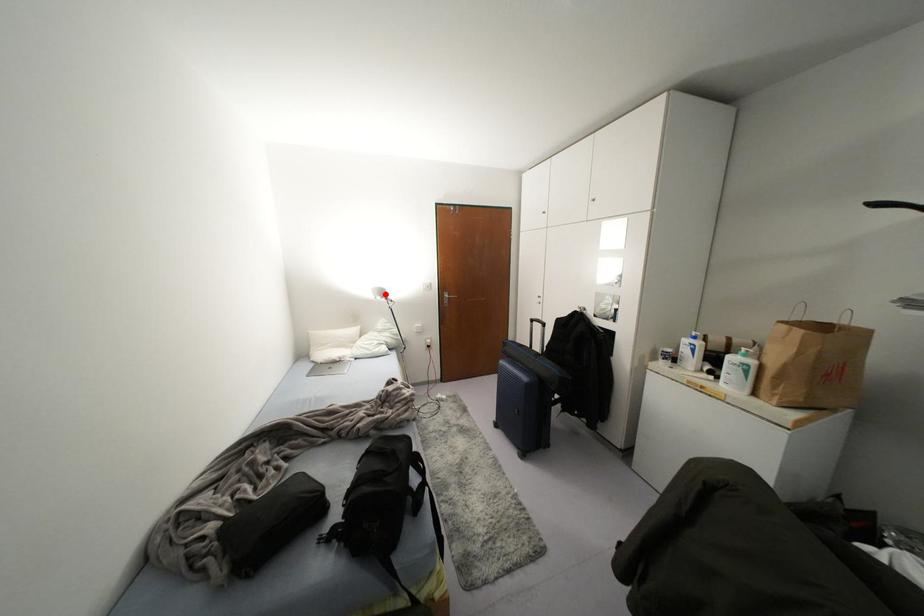
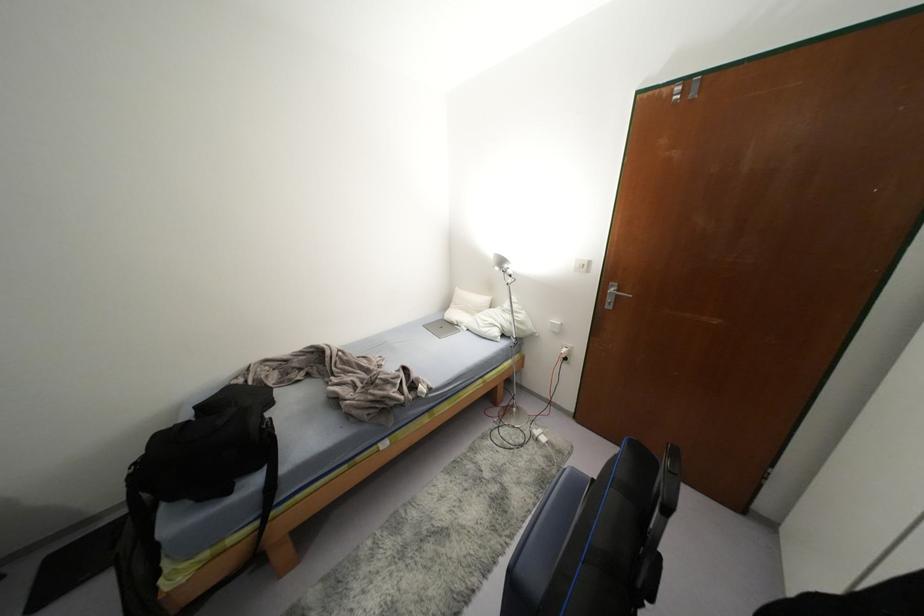
Locate, in the second image, the point that corresponds to the highlighted location in the first image.

(505, 265)